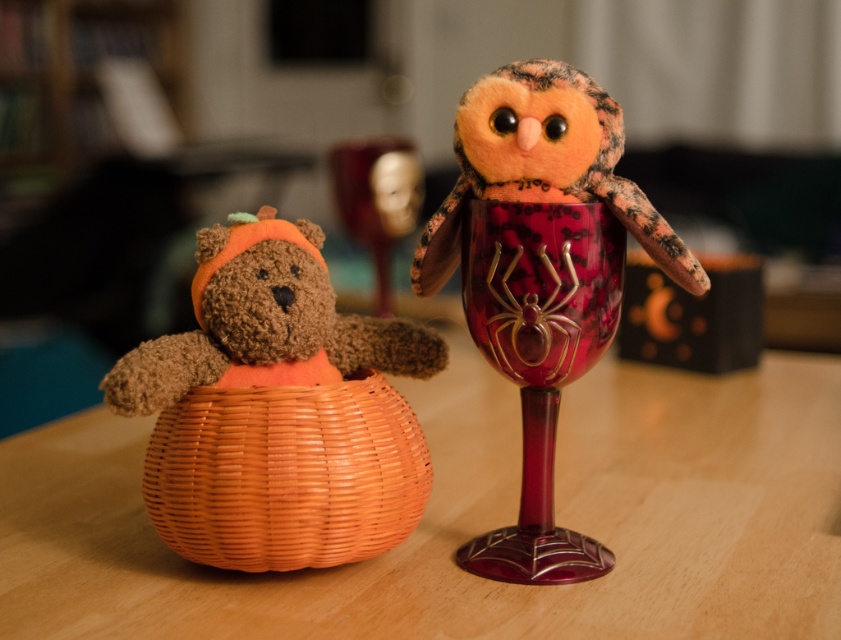
Is wooden table at center closer to camera compared to orange wicker basket at lower left?

Yes, wooden table at center is closer to the viewer.

Is wooden table at center taller than orange wicker basket at lower left?

Yes, wooden table at center is taller than orange wicker basket at lower left.

Where is `wooden table at center`? wooden table at center is located at coordinates (475, 518).

Between wooden table at center and brown fuzzy teddy bear at left, which one has more height?

With more height is wooden table at center.

Based on the photo, is wooden table at center to the left of brown fuzzy teddy bear at left from the viewer's perspective?

Incorrect, wooden table at center is not on the left side of brown fuzzy teddy bear at left.

At what (x,y) coordinates should I click in order to perform the action: click on wooden table at center. Please return your answer as a coordinate pair (x, y). Looking at the image, I should click on (475, 518).

Which of these two, velvety orange owl at center or brown fuzzy teddy bear at left, stands taller?

With more height is velvety orange owl at center.

Is velvety orange owl at center in front of brown fuzzy teddy bear at left?

No, velvety orange owl at center is further to the viewer.

Measure the distance between point [521,374] and camera.

Point [521,374] is 29.20 inches away from camera.

Identify the location of velvety orange owl at center. This screenshot has height=640, width=841. (541, 275).